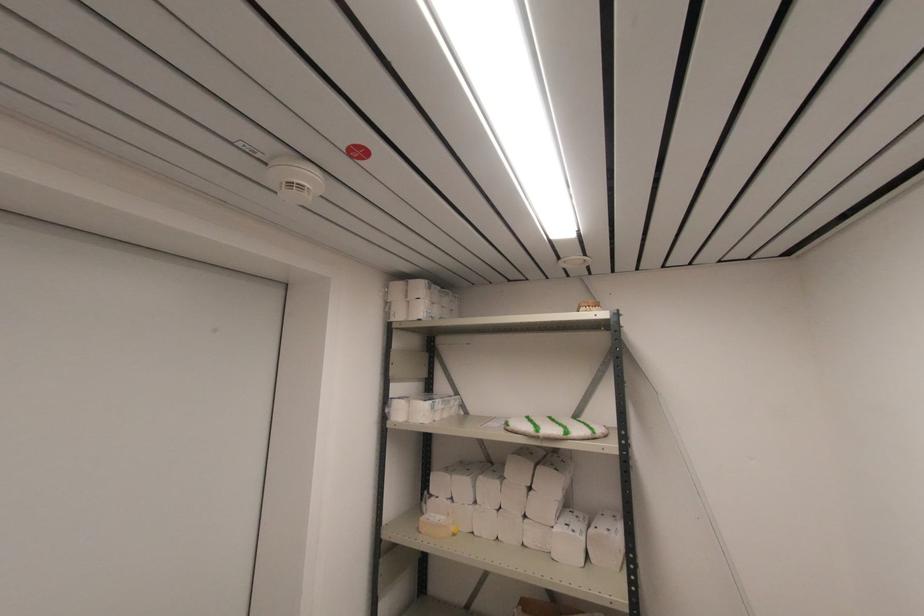
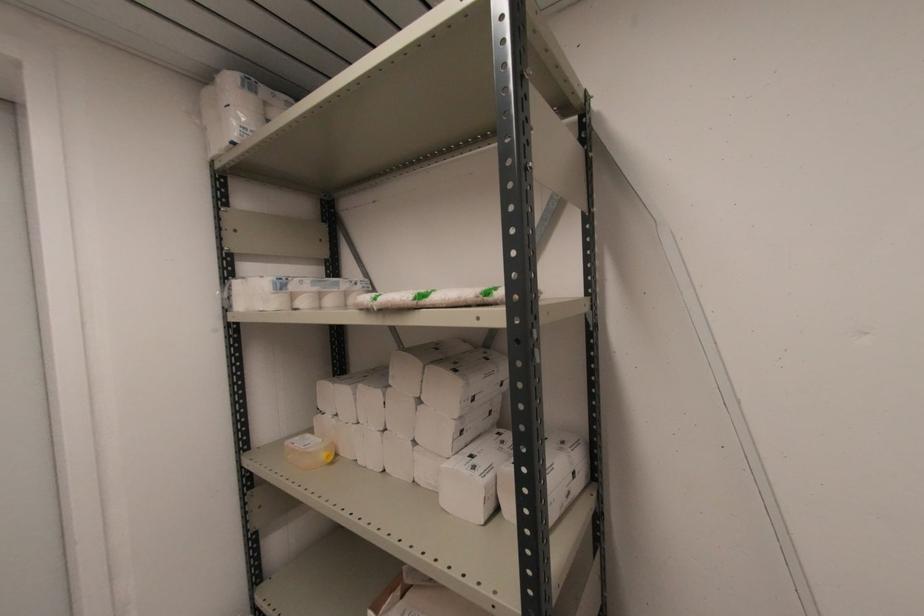
Question: The first image is from the beginning of the video and the second image is from the end. How did the camera likely rotate when shooting the video?

Choices:
 (A) Left
 (B) Right
 (C) Up
 (D) Down

Answer: (D)